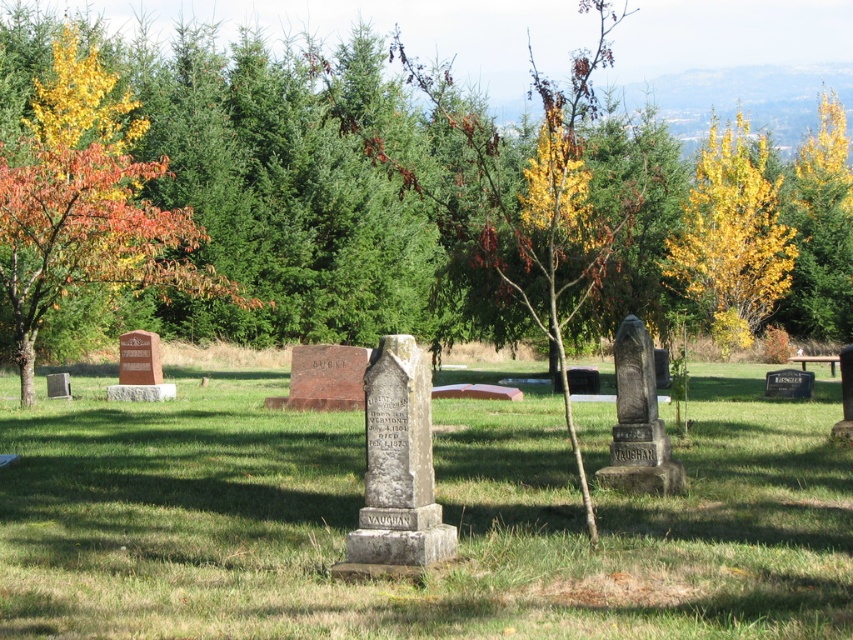
Is orange leafy tree at left wider than yellow leafy tree at upper right?

Incorrect, orange leafy tree at left's width does not surpass yellow leafy tree at upper right's.

Who is positioned more to the left, orange leafy tree at left or yellow leafy tree at upper right?

From the viewer's perspective, orange leafy tree at left appears more on the left side.

Which is in front, point (210, 275) or point (720, 145)?

Point (210, 275) is in front.

Identify the location of orange leafy tree at left. (90, 237).

Does green grass at center have a lesser width compared to yellow leafy tree at upper right?

→ In fact, green grass at center might be wider than yellow leafy tree at upper right.

Measure the distance between green grass at center and yellow leafy tree at upper right.

green grass at center is 27.40 meters away from yellow leafy tree at upper right.

This screenshot has height=640, width=853. I want to click on green grass at center, so click(x=444, y=515).

Which is more to the right, green grass at center or orange leafy tree at left?

Positioned to the right is green grass at center.

Is green grass at center below orange leafy tree at left?

Yes.

Is point (608, 403) positioned in front of point (10, 202)?

No, it is behind (10, 202).

Identify the location of green grass at center. The height and width of the screenshot is (640, 853). (444, 515).